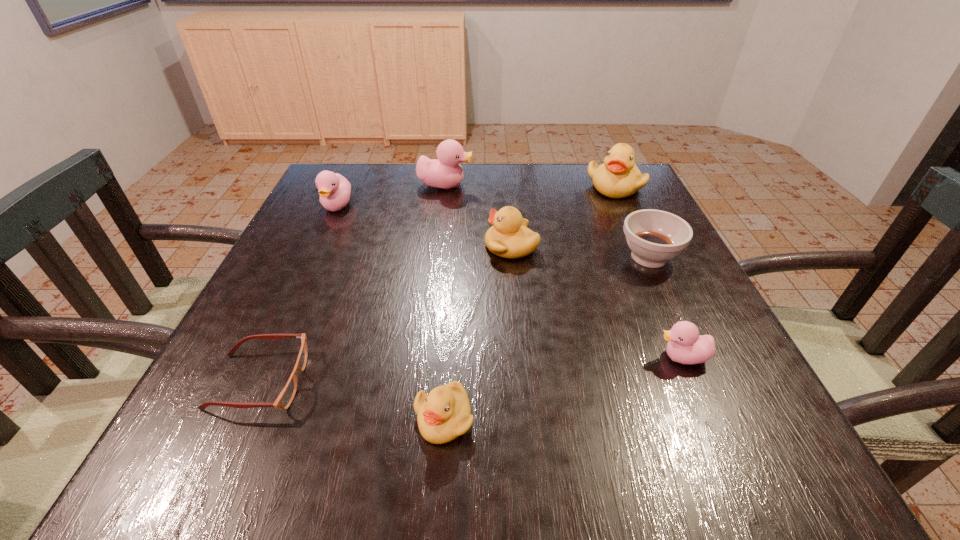
Find the location of a particular element. Image resolution: width=960 pixels, height=540 pixels. the farthest pink duckling is located at coordinates (445, 172).

I want to click on the biggest pink duckling, so click(445, 172).

Find the location of a particular element. the rightmost yellow duckling is located at coordinates (618, 177).

Locate an element on the screen. This screenshot has width=960, height=540. the biggest yellow duckling is located at coordinates (618, 177).

This screenshot has width=960, height=540. In order to click on the second farthest pink duckling in this screenshot , I will do `click(334, 189)`.

Where is `the leftmost pink duckling`? This screenshot has height=540, width=960. the leftmost pink duckling is located at coordinates (334, 189).

Identify the location of the fourth duckling from left to right. (509, 237).

The image size is (960, 540). I want to click on the fourth farthest duckling, so click(x=509, y=237).

Where is `soup bowl`? soup bowl is located at coordinates (654, 236).

Locate an element on the screen. This screenshot has height=540, width=960. the nearest pink duckling is located at coordinates (685, 346).